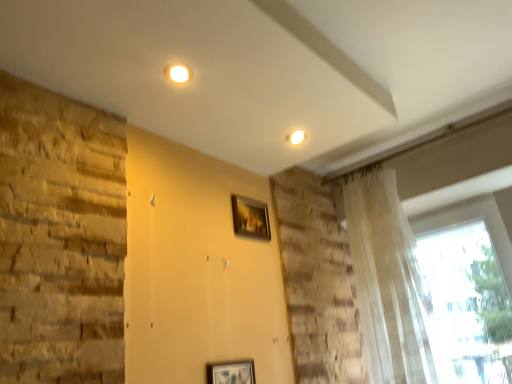
Find the location of a particular element. This screenshot has width=512, height=384. translucent fabric curtain at upper right is located at coordinates (387, 280).

Describe the element at coordinates (387, 280) in the screenshot. I see `translucent fabric curtain at upper right` at that location.

This screenshot has height=384, width=512. What do you see at coordinates (250, 218) in the screenshot?
I see `wooden frame at center` at bounding box center [250, 218].

Where is `wooden frame at center`? wooden frame at center is located at coordinates (250, 218).

Where is `translucent fabric curtain at upper right`? translucent fabric curtain at upper right is located at coordinates (387, 280).

Which is more to the left, wooden frame at center or translucent fabric curtain at upper right?

wooden frame at center is more to the left.

Is wooden frame at center positioned behind translucent fabric curtain at upper right?

Yes, wooden frame at center is further from the camera.

Is point (242, 215) closer to camera compared to point (359, 240)?

Yes, it is in front of point (359, 240).

From the image's perspective, is wooden frame at center located beneath translucent fabric curtain at upper right?

Actually, wooden frame at center appears above translucent fabric curtain at upper right in the image.

Based on the photo, from a real-world perspective, is wooden frame at center positioned above or below translucent fabric curtain at upper right?

From a real-world perspective, wooden frame at center is physically above translucent fabric curtain at upper right.

In the scene shown: Considering the relative sizes of wooden frame at center and translucent fabric curtain at upper right in the image provided, is wooden frame at center thinner than translucent fabric curtain at upper right?

Yes.

Who is taller, wooden frame at center or translucent fabric curtain at upper right?

With more height is translucent fabric curtain at upper right.

Between wooden frame at center and translucent fabric curtain at upper right, which one has smaller size?

wooden frame at center is smaller.

Do you think wooden frame at center is within translucent fabric curtain at upper right, or outside of it?

The correct answer is: outside.

Are wooden frame at center and translucent fabric curtain at upper right located far from each other?

No.

Is wooden frame at center oriented towards translucent fabric curtain at upper right?

No, wooden frame at center is not aimed at translucent fabric curtain at upper right.

Can you tell me how much wooden frame at center and translucent fabric curtain at upper right differ in facing direction?

They differ by 88.9 degrees in their facing directions.

Measure the distance between wooden frame at center and translucent fabric curtain at upper right.

The distance of wooden frame at center from translucent fabric curtain at upper right is 57.73 centimeters.

Locate an element on the screen. The image size is (512, 384). curtain to the right of wooden frame at center is located at coordinates (387, 280).

Considering the positions of objects translucent fabric curtain at upper right and wooden frame at center in the image provided, who is more to the left, translucent fabric curtain at upper right or wooden frame at center?

wooden frame at center.

Is translucent fabric curtain at upper right behind wooden frame at center?

No, it is not.

Which point is more distant from viewer, (360, 294) or (269, 225)?

The point (360, 294) is behind.

From the image's perspective, is translucent fabric curtain at upper right positioned above or below wooden frame at center?

translucent fabric curtain at upper right is below wooden frame at center.

From a real-world perspective, is translucent fabric curtain at upper right on top of wooden frame at center?

No, from a real-world perspective, translucent fabric curtain at upper right is not above wooden frame at center.

Considering the relative sizes of translucent fabric curtain at upper right and wooden frame at center in the image provided, is translucent fabric curtain at upper right thinner than wooden frame at center?

No, translucent fabric curtain at upper right is not thinner than wooden frame at center.

Is translucent fabric curtain at upper right shorter than wooden frame at center?

Incorrect, the height of translucent fabric curtain at upper right does not fall short of that of wooden frame at center.

Considering the relative sizes of translucent fabric curtain at upper right and wooden frame at center in the image provided, is translucent fabric curtain at upper right smaller than wooden frame at center?

No, translucent fabric curtain at upper right is not smaller than wooden frame at center.

Would you say translucent fabric curtain at upper right is outside wooden frame at center?

translucent fabric curtain at upper right is positioned outside wooden frame at center.

Are translucent fabric curtain at upper right and wooden frame at center beside each other?

No, translucent fabric curtain at upper right is not touching wooden frame at center.

Is translucent fabric curtain at upper right facing towards wooden frame at center?

No, translucent fabric curtain at upper right is not turned towards wooden frame at center.

Based on the photo, how different are the orientations of translucent fabric curtain at upper right and wooden frame at center in degrees?

translucent fabric curtain at upper right and wooden frame at center are facing 88.9 degrees away from each other.

Locate an element on the screen. Image resolution: width=512 pixels, height=384 pixels. picture frame lying on the left of translucent fabric curtain at upper right is located at coordinates (250, 218).

Where is `picture frame positioned vertically above the translucent fabric curtain at upper right (from a real-world perspective)`? The image size is (512, 384). picture frame positioned vertically above the translucent fabric curtain at upper right (from a real-world perspective) is located at coordinates 250,218.

I want to click on curtain on the right of the wooden frame at center, so click(387, 280).